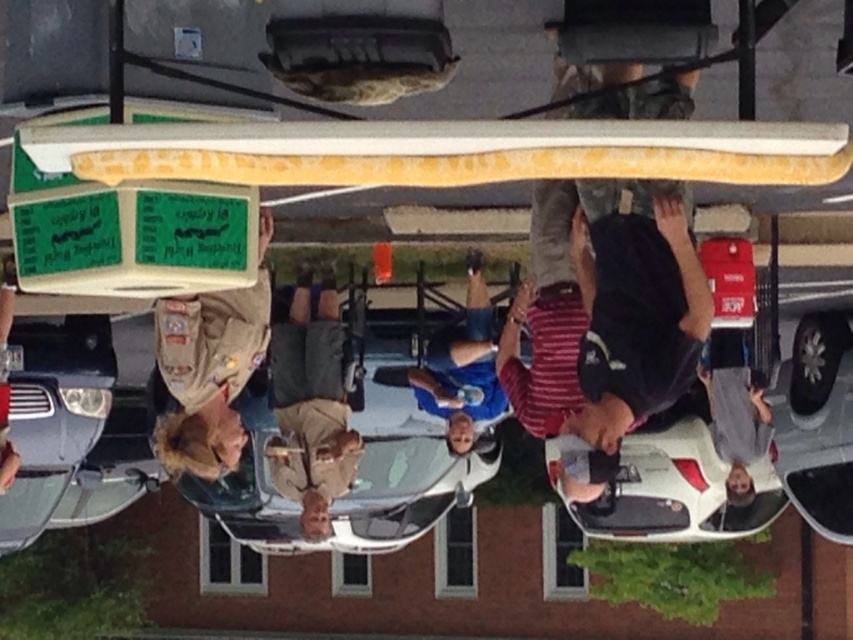
Question: Which point is farther to the camera?

Choices:
 (A) (500, 385)
 (B) (189, 358)
 (C) (305, 477)
 (D) (485, 461)

Answer: (D)

Question: Which point is closer to the camera?

Choices:
 (A) (434, 408)
 (B) (451, 484)
 (C) (289, 486)
 (D) (259, 332)

Answer: (D)

Question: Does white glossy car at lower center appear over brown canvas backpack at center?

Choices:
 (A) yes
 (B) no

Answer: (B)

Question: Is the position of white glossy car at lower center more distant than that of blue denim jeans at center?

Choices:
 (A) no
 (B) yes

Answer: (A)

Question: Which of these objects is positioned closest to the white glossy car at lower center?

Choices:
 (A) blue denim jeans at center
 (B) metallic silver car at center
 (C) brown canvas backpack at center
 (D) brown uniform at center

Answer: (A)

Question: In this image, where is white glossy car at lower center located relative to blue denim jeans at center?

Choices:
 (A) left
 (B) right

Answer: (B)